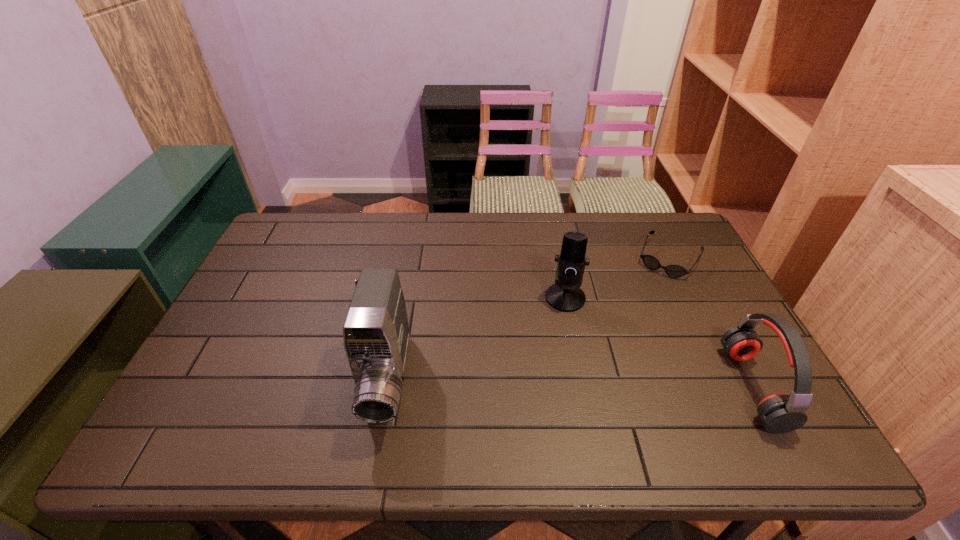
Identify the location of object that is positioned at the far right corner. (651, 262).

Where is `object that is at the near right corner`? The image size is (960, 540). object that is at the near right corner is located at coordinates (780, 413).

This screenshot has width=960, height=540. I want to click on blank area at the far edge, so click(448, 221).

Find the location of a particular element. The width and height of the screenshot is (960, 540). vacant space at the near edge of the desktop is located at coordinates (316, 401).

Where is `vacant space at the right edge of the desktop`? vacant space at the right edge of the desktop is located at coordinates (706, 278).

In the image, there is a desktop. What are the coordinates of `vacant space at the far left corner` in the screenshot? It's located at (290, 219).

Where is `blank space at the far right corner of the desktop`? Image resolution: width=960 pixels, height=540 pixels. blank space at the far right corner of the desktop is located at coordinates (644, 235).

Where is `free spot between the leftmost object and the earphone`? Image resolution: width=960 pixels, height=540 pixels. free spot between the leftmost object and the earphone is located at coordinates (570, 383).

At what (x,y) coordinates should I click in order to perform the action: click on free area in between the earphone and the sunglasses. Please return your answer as a coordinate pair (x, y). The height and width of the screenshot is (540, 960). Looking at the image, I should click on (710, 323).

Find the location of a particular element. free space between the third nearest object and the farthest object is located at coordinates (617, 278).